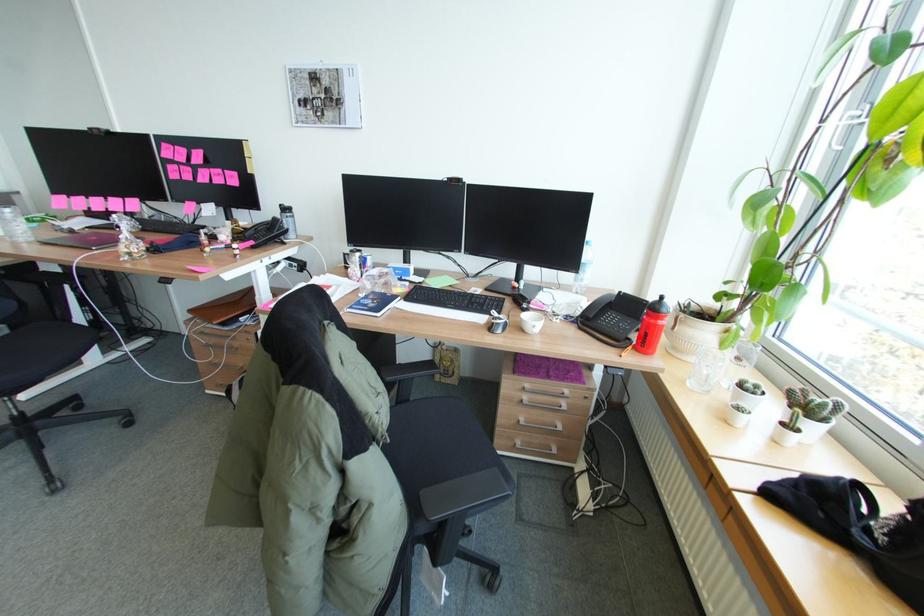
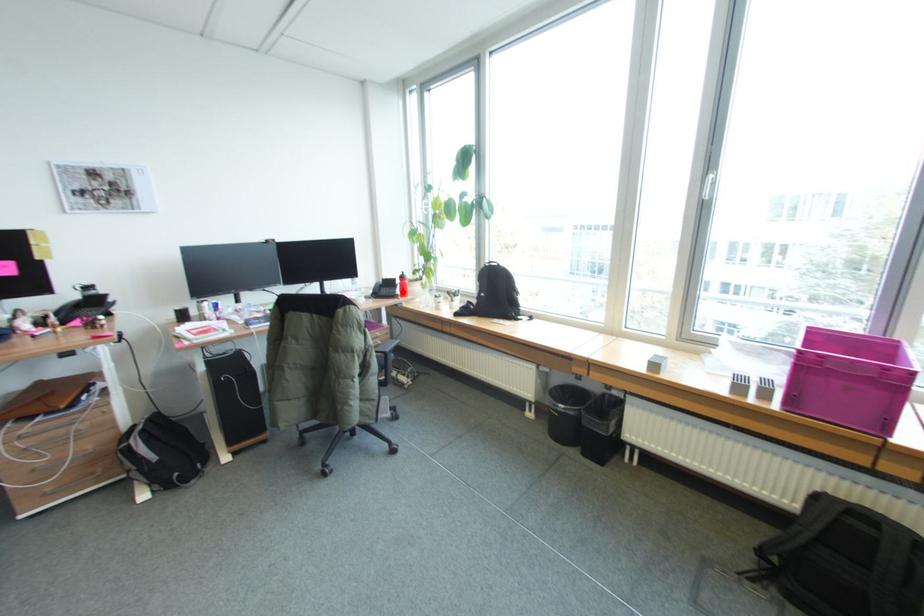
I am providing you with two images of the same scene from different viewpoints. A red point is marked on the first image and another point is marked on the second image. Do the highlighted points in image1 and image2 indicate the same real-world spot?

Yes